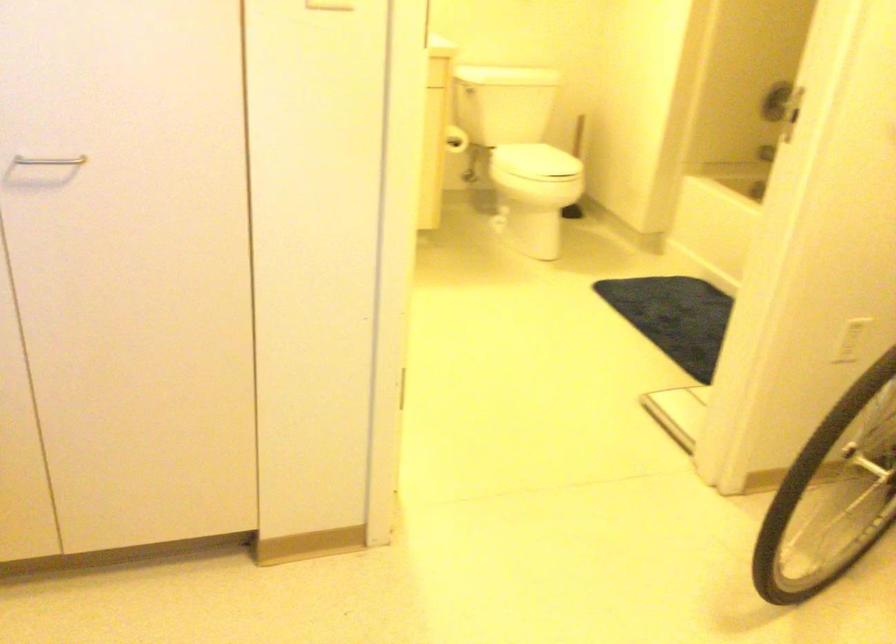
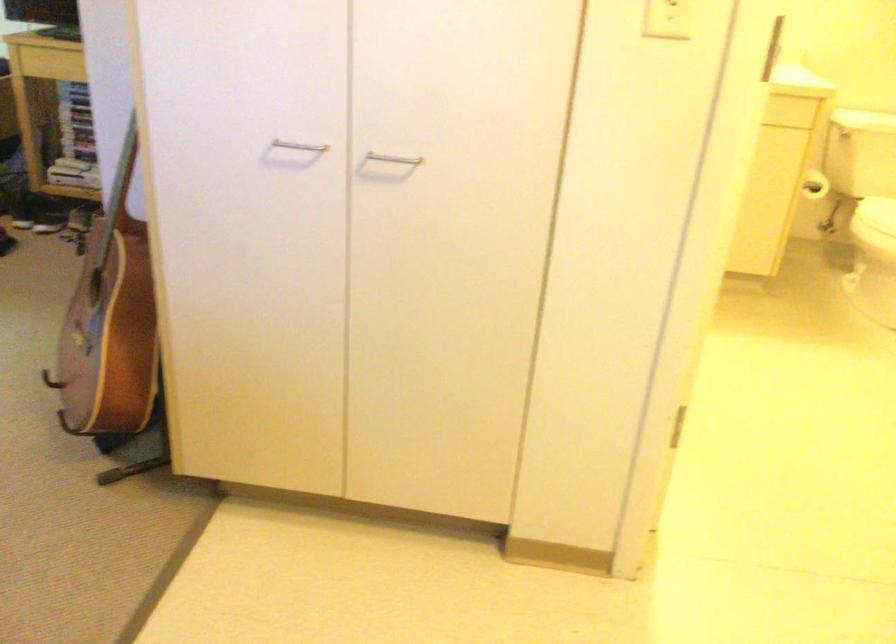
Find the pixel in the second image that matches point 71,158 in the first image.

(393, 158)